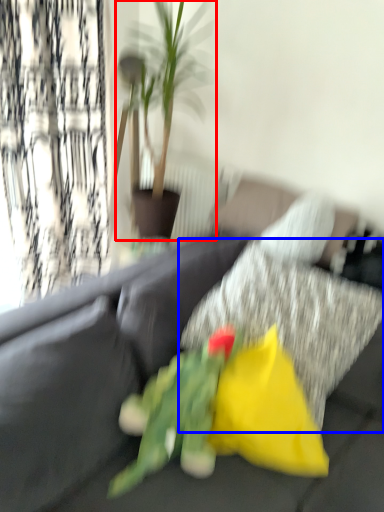
Question: Among these objects, which one is nearest to the camera, houseplant (highlighted by a red box) or pillow (highlighted by a blue box)?

Choices:
 (A) houseplant
 (B) pillow

Answer: (B)